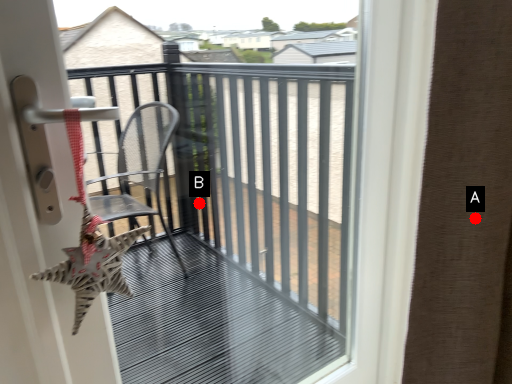
Question: Two points are circled on the image, labeled by A and B beside each circle. Which point appears farthest from the camera in this image?

Choices:
 (A) A is further
 (B) B is further

Answer: (B)